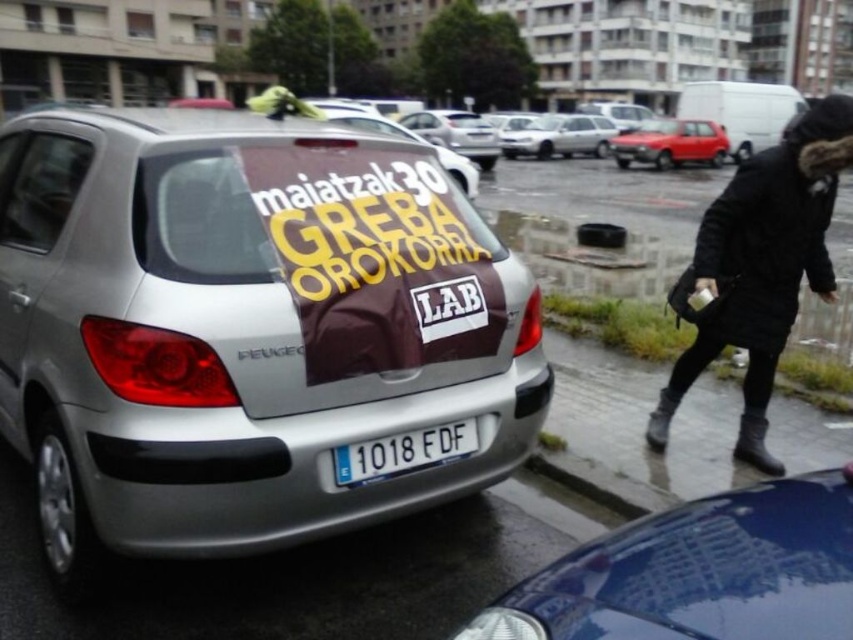
You are a photographer trying to capture the silver metallic sedan at center and the white plastic license plate at center in a single shot. Based on their sizes, which object should you focus on first to ensure both are in frame?

The white plastic license plate at center has a lesser height compared to the silver metallic sedan at center, so you should focus on the silver metallic sedan at center first to ensure both are in frame.

You are a photographer trying to capture both the shiny blue car at lower right and the silver metallic hatchback at center in a single frame. Given their heights, which car should you position closer to the camera to ensure both are fully visible in the photo?

The shiny blue car at lower right has a lesser height compared to the silver metallic hatchback at center. To ensure both are fully visible, position the shiny blue car at lower right closer to the camera so its smaller size in the frame compensates for its shorter height, while the taller silver metallic hatchback at center can be placed slightly farther back to balance their appearances.

You are a delivery driver who needs to photograph the white plastic license plate at center for a delivery confirmation. Based on the scene, where should you position your camera to capture it clearly?

The white plastic license plate at center is located at point (403, 452), so you should position your camera directly facing the center of the car to capture it clearly.